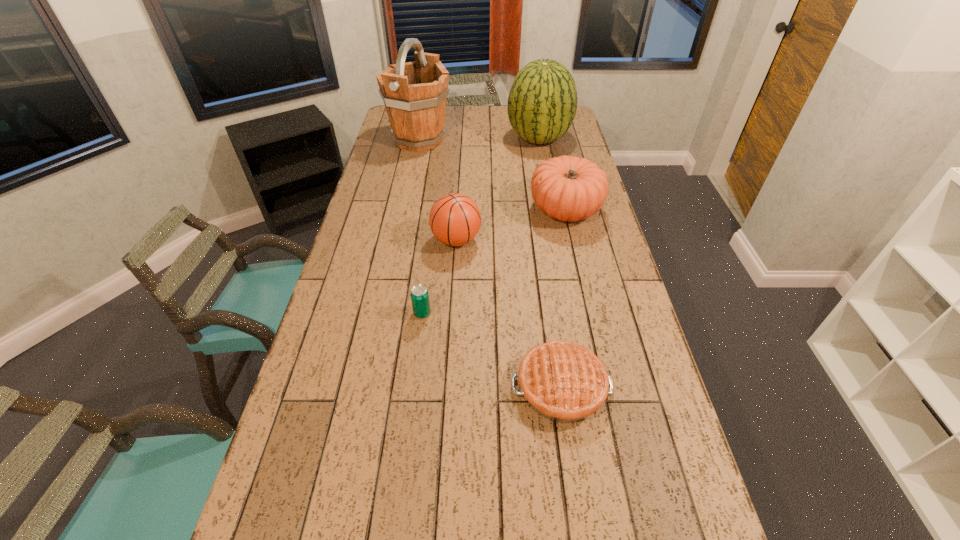
This screenshot has width=960, height=540. Find the location of `bucket`. bucket is located at coordinates (414, 93).

The height and width of the screenshot is (540, 960). In order to click on the fifth shortest object in this screenshot , I will do `click(542, 102)`.

Locate an element on the screen. pumpkin is located at coordinates (567, 188).

The image size is (960, 540). In order to click on basketball in this screenshot , I will do `click(455, 219)`.

You are a GUI agent. You are given a task and a screenshot of the screen. Output one action in this format:
    pyautogui.click(x=<x>, y=<y>)
    Task: Click on the beer can
    The image size is (960, 540).
    Given the screenshot: What is the action you would take?
    pyautogui.click(x=419, y=294)

This screenshot has height=540, width=960. In order to click on pie in this screenshot , I will do `click(564, 382)`.

You are a GUI agent. You are given a task and a screenshot of the screen. Output one action in this format:
    pyautogui.click(x=<x>, y=<y>)
    Task: Click on the blank area located 0.160m on the right of the tallest object
    Image resolution: width=960 pixels, height=540 pixels.
    Given the screenshot: What is the action you would take?
    pyautogui.click(x=487, y=140)

You are a GUI agent. You are given a task and a screenshot of the screen. Output one action in this format:
    pyautogui.click(x=<x>, y=<y>)
    Task: Click on the vacant space located on the left of the fifth shortest object
    The image size is (960, 540).
    Given the screenshot: What is the action you would take?
    [x=461, y=139]

At what (x,y) coordinates should I click in order to perform the action: click on free space located on the front of the pumpkin. Please return your answer as a coordinate pair (x, y). Looking at the image, I should click on (581, 280).

Where is `vacant space located on the left of the basketball`? vacant space located on the left of the basketball is located at coordinates (392, 240).